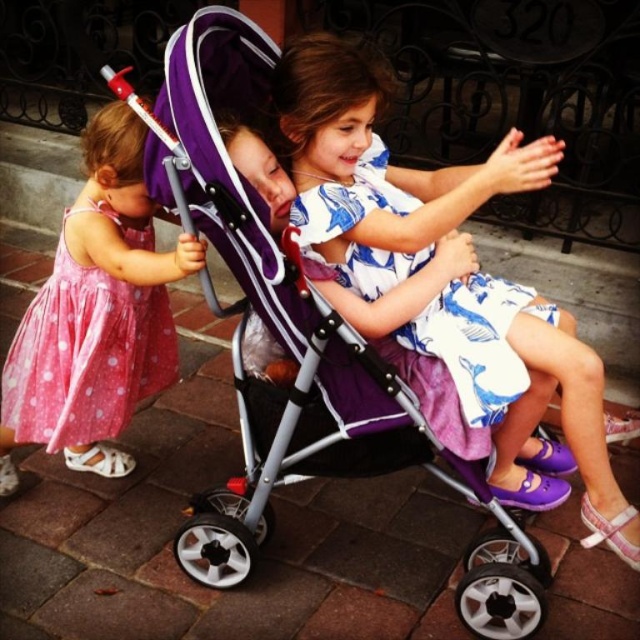
You are standing at the point with coordinates point [413,272] and want to walk towards the point with coordinates point [529,326]. Which direction should you move relative to your current position?

You should move forward because point [529,326] is in front of point [413,272].

You are a photographer trying to capture a candid shot of the children in the scene. You want to ensure that both the purple fabric stroller at center and the white printed fabric dress at center are clearly visible in the frame. Based on their positions, which object should you focus on first to ensure both are in the shot?

The purple fabric stroller at center is positioned on the left side of the white printed fabric dress at center. To ensure both are in the shot, focus on the purple fabric stroller at center first as it is closer to the edge, allowing the dress to naturally fall into the frame.